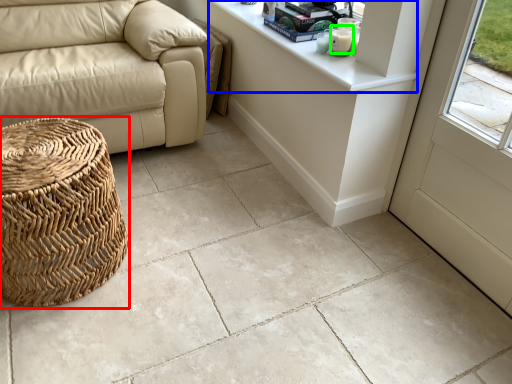
Question: Which object is positioned closest to basket (highlighted by a red box)? Select from counter top (highlighted by a blue box) and candle (highlighted by a green box).

Choices:
 (A) counter top
 (B) candle

Answer: (A)